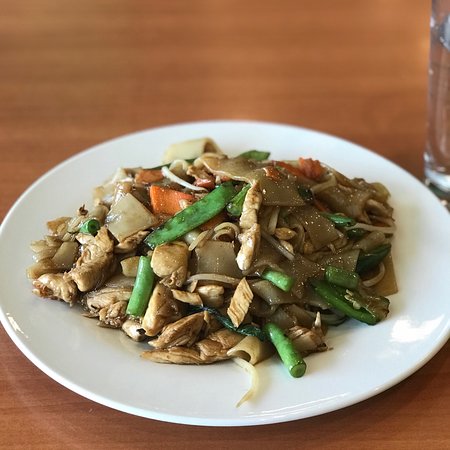
At what (x,y) coordinates should I click in order to perform the action: click on wooden table. Please return your answer as a coordinate pair (x, y). Looking at the image, I should click on (390, 422).